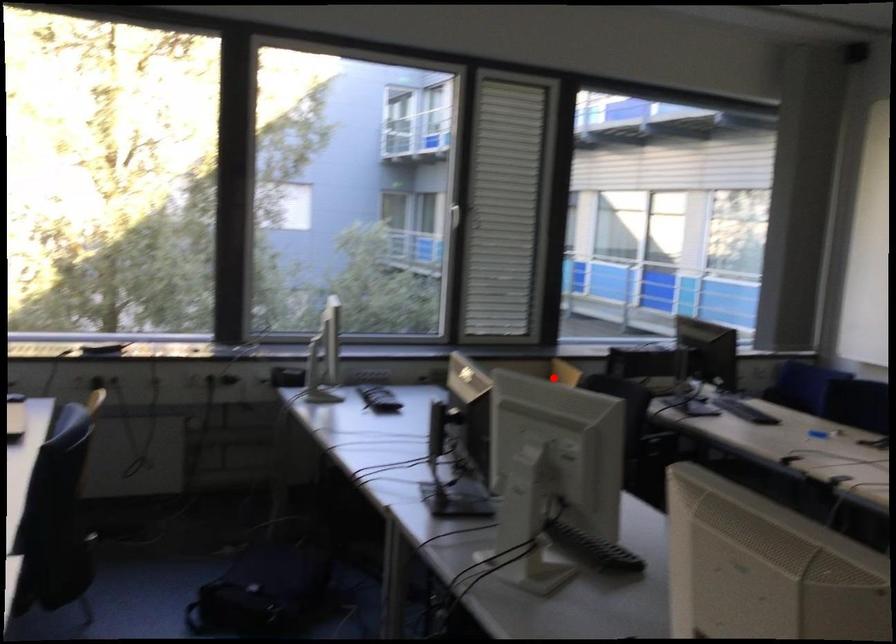
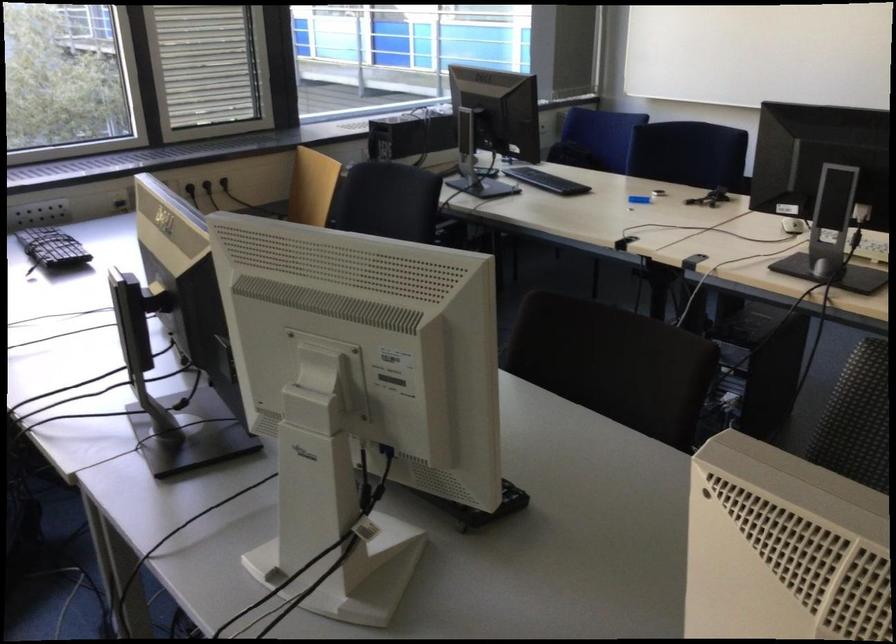
Question: I am providing you with two images of the same scene from different viewpoints. Image1 has a red point marked. In image2, the corresponding 3D location appears at what relative position? Reply with the corresponding letter.

Choices:
 (A) Closer
 (B) Farther

Answer: (A)